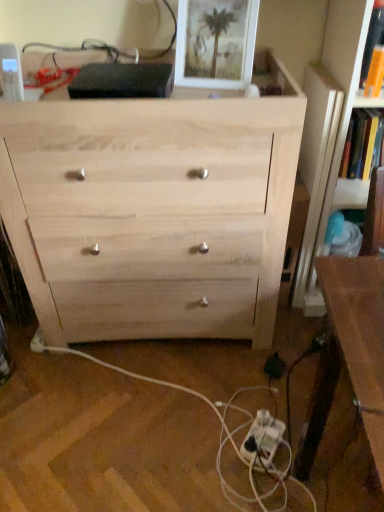
Where is `vacant space in front of white plastic extension cord at lower center`? The height and width of the screenshot is (512, 384). vacant space in front of white plastic extension cord at lower center is located at coordinates (270, 485).